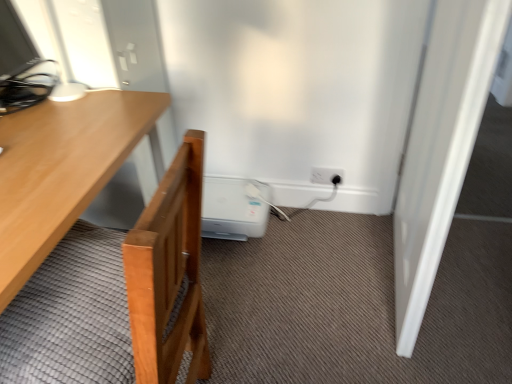
Identify the location of vacant area that is in front of white smooth door at right. (423, 343).